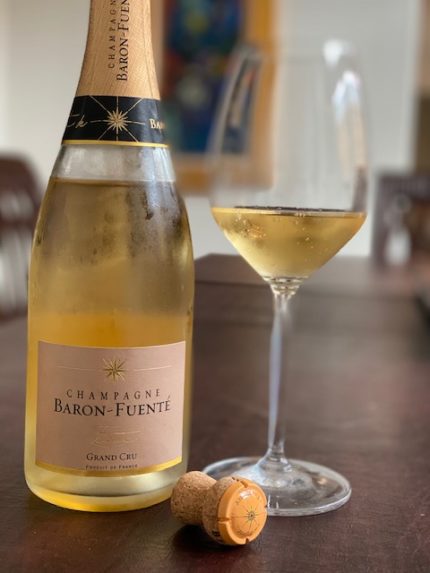
Locate an element on the screen. wine glass is located at coordinates pos(292,243).